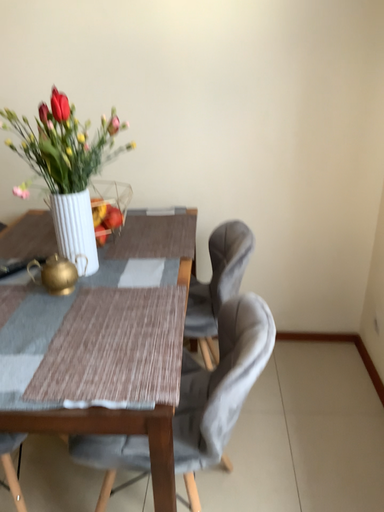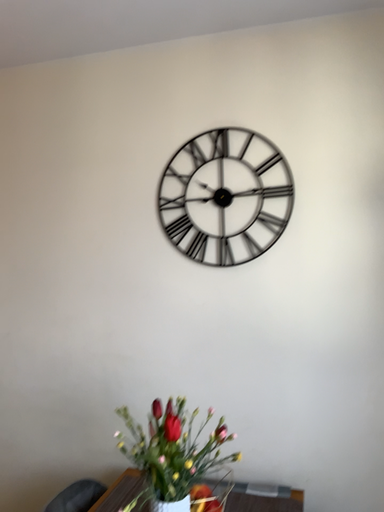
Question: Which way did the camera rotate in the video?

Choices:
 (A) rotated right
 (B) rotated left

Answer: (B)